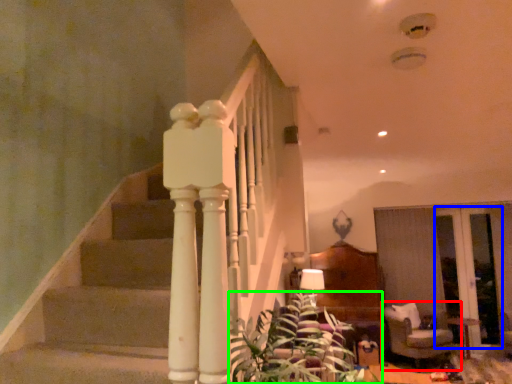
Question: Which is farther away from furniture (highlighted by a red box)? glass door (highlighted by a blue box) or plant (highlighted by a green box)?

Choices:
 (A) glass door
 (B) plant

Answer: (B)